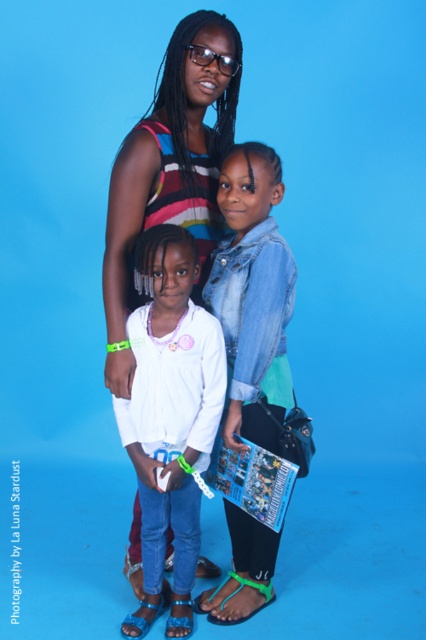
You are a delivery robot that needs to deliver a package to the person wearing the green rubber sandal at lower center. The robot has a sensor that can detect objects within 70 centimeters. Is the denim jacket at center within the sensor range of the robot?

The denim jacket at center is 80.19 centimeters away from the green rubber sandal at lower center. Since the sensor can detect up to 70 centimeters, the denim jacket at center is outside the sensor range.

You are a photographer setting up for a group photo. You have two subjects wearing the white matte shirt at center and the denim jacket at center. You want to ensure that the subject with the wider clothing item is placed in the middle of the frame. Which subject should you position in the center?

The white matte shirt at center has a larger width than the denim jacket at center, so you should position the subject wearing the white matte shirt at center in the middle of the frame to highlight its wider silhouette.